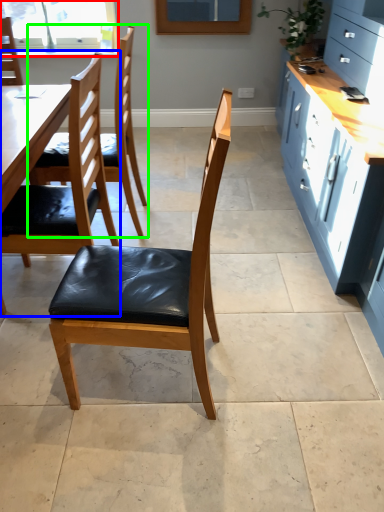
Question: Which is farther away from window (highlighted by a red box)? chair (highlighted by a blue box) or chair (highlighted by a green box)?

Choices:
 (A) chair
 (B) chair

Answer: (A)